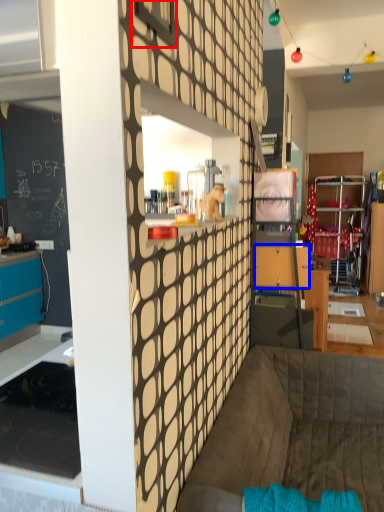
Question: Among these objects, which one is farthest to the camera, window (highlighted by a red box) or drawer (highlighted by a blue box)?

Choices:
 (A) window
 (B) drawer

Answer: (B)